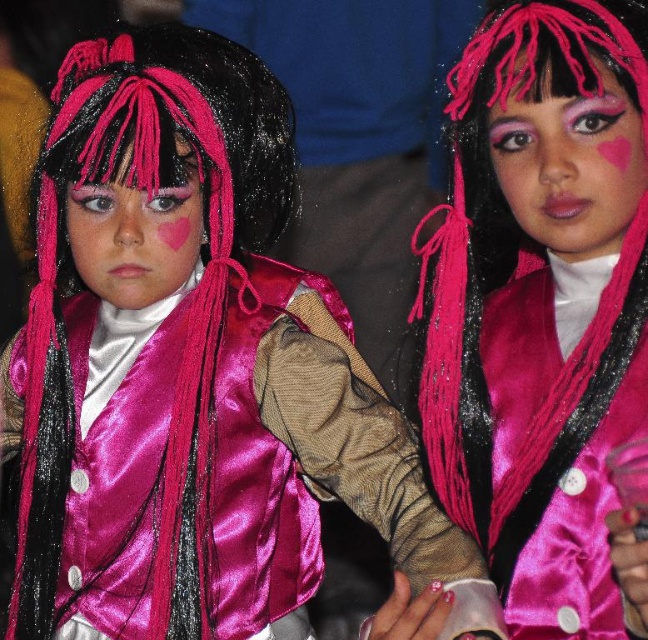
Question: Estimate the real-world distances between objects in this image. Which object is farther from the pink matte wig at center?

Choices:
 (A) matte pink wig at left
 (B) satin pink vest at center

Answer: (A)

Question: Which object appears farthest from the camera in this image?

Choices:
 (A) pink matte wig at center
 (B) matte pink wig at left
 (C) satin pink vest at center

Answer: (B)

Question: Which object appears farthest from the camera in this image?

Choices:
 (A) matte pink wig at left
 (B) satin pink vest at center
 (C) pink matte wig at center

Answer: (A)

Question: Is satin pink vest at center to the left of matte pink wig at left from the viewer's perspective?

Choices:
 (A) no
 (B) yes

Answer: (A)

Question: Can you confirm if pink matte wig at center is smaller than matte pink wig at left?

Choices:
 (A) no
 (B) yes

Answer: (A)

Question: Does satin pink vest at center appear on the right side of pink matte wig at center?

Choices:
 (A) no
 (B) yes

Answer: (A)